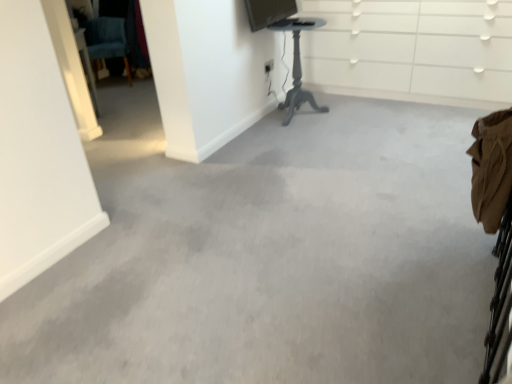
Question: Is teal fabric swivel chair at upper left oriented away from white glossy dresser at upper center?

Choices:
 (A) yes
 (B) no

Answer: (B)

Question: Considering the relative positions of teal fabric swivel chair at upper left and white glossy dresser at upper center in the image provided, is teal fabric swivel chair at upper left behind white glossy dresser at upper center?

Choices:
 (A) no
 (B) yes

Answer: (B)

Question: Considering the relative sizes of teal fabric swivel chair at upper left and white glossy dresser at upper center in the image provided, is teal fabric swivel chair at upper left bigger than white glossy dresser at upper center?

Choices:
 (A) yes
 (B) no

Answer: (B)

Question: Does teal fabric swivel chair at upper left appear on the right side of white glossy dresser at upper center?

Choices:
 (A) no
 (B) yes

Answer: (A)

Question: Is teal fabric swivel chair at upper left placed right next to white glossy dresser at upper center?

Choices:
 (A) no
 (B) yes

Answer: (A)

Question: Is teal fabric swivel chair at upper left closer to camera compared to white glossy dresser at upper center?

Choices:
 (A) no
 (B) yes

Answer: (A)

Question: Considering the relative sizes of matte black monitor at upper center and white glossy dresser at upper center in the image provided, is matte black monitor at upper center smaller than white glossy dresser at upper center?

Choices:
 (A) yes
 (B) no

Answer: (A)

Question: Is matte black monitor at upper center facing away from white glossy dresser at upper center?

Choices:
 (A) yes
 (B) no

Answer: (B)

Question: Is matte black monitor at upper center bigger than white glossy dresser at upper center?

Choices:
 (A) yes
 (B) no

Answer: (B)

Question: From the image's perspective, does matte black monitor at upper center appear higher than white glossy dresser at upper center?

Choices:
 (A) yes
 (B) no

Answer: (A)

Question: Is the position of matte black monitor at upper center more distant than that of white glossy dresser at upper center?

Choices:
 (A) no
 (B) yes

Answer: (A)

Question: Can you confirm if matte black monitor at upper center is taller than white glossy dresser at upper center?

Choices:
 (A) yes
 (B) no

Answer: (B)

Question: Is white glossy dresser at upper center to the left of matte black monitor at upper center from the viewer's perspective?

Choices:
 (A) no
 (B) yes

Answer: (A)